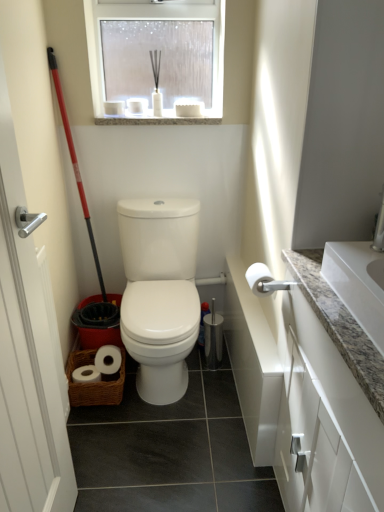
This screenshot has height=512, width=384. I want to click on white granite sink at upper right, so click(360, 279).

What do you see at coordinates (259, 279) in the screenshot? The width and height of the screenshot is (384, 512). I see `white matte toilet paper at right` at bounding box center [259, 279].

What is the approximate width of white glossy toilet at center?

white glossy toilet at center is 17.21 inches wide.

The image size is (384, 512). Find the location of `silver metallic screen door at left`. silver metallic screen door at left is located at coordinates (27, 289).

In terms of height, does white granite sink at upper right look taller or shorter compared to granite at upper center?

Considering their sizes, white granite sink at upper right has more height than granite at upper center.

From a real-world perspective, who is located higher, white granite sink at upper right or granite at upper center?

granite at upper center is physically above.

From the image's perspective, is white granite sink at upper right located above or below granite at upper center?

Based on their image positions, white granite sink at upper right is located beneath granite at upper center.

Is white granite sink at upper right positioned far away from granite at upper center?

Indeed, white granite sink at upper right is not near granite at upper center.

Considering the sizes of objects white matte toilet paper at right and white granite sink at upper right in the image provided, who is smaller, white matte toilet paper at right or white granite sink at upper right?

white matte toilet paper at right is smaller.

Is white matte toilet paper at right touching white granite sink at upper right?

white matte toilet paper at right and white granite sink at upper right are clearly separated.

Considering the sizes of objects white matte toilet paper at right and white granite sink at upper right in the image provided, who is taller, white matte toilet paper at right or white granite sink at upper right?

Standing taller between the two is white granite sink at upper right.

Identify the location of sink that appears on the right of silver metallic screen door at left. (360, 279).

Would you say silver metallic screen door at left is part of white granite sink at upper right's contents?

No.

Is white granite sink at upper right facing towards silver metallic screen door at left?

Yes, white granite sink at upper right is facing silver metallic screen door at left.

Considering the relative sizes of white granite sink at upper right and translucent glass window at upper center in the image provided, is white granite sink at upper right thinner than translucent glass window at upper center?

In fact, white granite sink at upper right might be wider than translucent glass window at upper center.

Which object is positioned more to the left, white granite sink at upper right or translucent glass window at upper center?

translucent glass window at upper center is more to the left.

Considering the relative sizes of white granite sink at upper right and translucent glass window at upper center in the image provided, is white granite sink at upper right taller than translucent glass window at upper center?

Incorrect, the height of white granite sink at upper right is not larger of that of translucent glass window at upper center.

Looking at the image, does white granite sink at upper right seem bigger or smaller compared to translucent glass window at upper center?

In the image, white granite sink at upper right appears to be smaller than translucent glass window at upper center.

Between white glossy toilet at center and silver metallic screen door at left, which one has larger width?

With larger width is white glossy toilet at center.

Is white glossy toilet at center touching silver metallic screen door at left?

No.

How different are the orientations of red plastic shovel at left and white matte toilet paper at right in degrees?

0.557 degrees separate the facing orientations of red plastic shovel at left and white matte toilet paper at right.

Can you confirm if red plastic shovel at left is shorter than white matte toilet paper at right?

Incorrect, the height of red plastic shovel at left does not fall short of that of white matte toilet paper at right.

Does point (55, 58) come in front of point (263, 278)?

No, (55, 58) is behind (263, 278).

Is white matte toilet paper at right at the back of red plastic shovel at left?

No, red plastic shovel at left is not facing the opposite direction of white matte toilet paper at right.

Considering their positions, is granite countertop at right located in front of or behind white granite sink at upper right?

granite countertop at right is positioned closer to the viewer than white granite sink at upper right.

Which of these two, granite countertop at right or white granite sink at upper right, is thinner?

white granite sink at upper right.

Is granite countertop at right situated inside white granite sink at upper right or outside?

granite countertop at right is not inside white granite sink at upper right, it's outside.

From the image's perspective, who appears lower, granite countertop at right or white granite sink at upper right?

granite countertop at right.

Identify the location of sink that is in front of the granite at upper center. The image size is (384, 512). (360, 279).

Where is `sink that is below the white matte toilet paper at right (from the image's perspective)`? sink that is below the white matte toilet paper at right (from the image's perspective) is located at coordinates (360, 279).

Estimate the real-world distances between objects in this image. Which object is closer to granite at upper center, red plastic shovel at left or translucent glass window at upper center?

Based on the image, translucent glass window at upper center appears to be nearer to granite at upper center.

Based on their spatial positions, is white matte toilet paper at right or red plastic shovel at left further from translucent glass window at upper center?

white matte toilet paper at right.

Considering their positions, is granite at upper center positioned closer to silver metallic screen door at left than granite countertop at right?

Based on the image, granite at upper center appears to be nearer to silver metallic screen door at left.

Considering their positions, is white glossy toilet at center positioned further to red plastic shovel at left than granite countertop at right?

The object further to red plastic shovel at left is granite countertop at right.

Which object lies nearer to the anchor point translucent glass window at upper center, granite countertop at right or red plastic shovel at left?

The object closer to translucent glass window at upper center is red plastic shovel at left.

Which object lies nearer to the anchor point white granite sink at upper right, granite countertop at right or granite at upper center?

The object closer to white granite sink at upper right is granite countertop at right.

Looking at the image, which one is located further to silver metallic screen door at left, white matte toilet paper at right or granite at upper center?

Based on the image, white matte toilet paper at right appears to be further to silver metallic screen door at left.

Looking at the image, which one is located further to white matte toilet paper at right, silver metallic screen door at left or white granite sink at upper right?

silver metallic screen door at left is further to white matte toilet paper at right.

Image resolution: width=384 pixels, height=512 pixels. Find the location of `shovel between granite countertop at right and white glossy toilet at center along the z-axis`. shovel between granite countertop at right and white glossy toilet at center along the z-axis is located at coordinates (75, 164).

Locate an element on the screen. Image resolution: width=384 pixels, height=512 pixels. screen door located between granite countertop at right and white glossy toilet at center in the depth direction is located at coordinates (27, 289).

Where is `toilet located between silver metallic screen door at left and translucent glass window at upper center in the depth direction`? The height and width of the screenshot is (512, 384). toilet located between silver metallic screen door at left and translucent glass window at upper center in the depth direction is located at coordinates (159, 292).

Locate an element on the screen. This screenshot has height=512, width=384. sink located between red plastic shovel at left and granite countertop at right in the left-right direction is located at coordinates (360, 279).